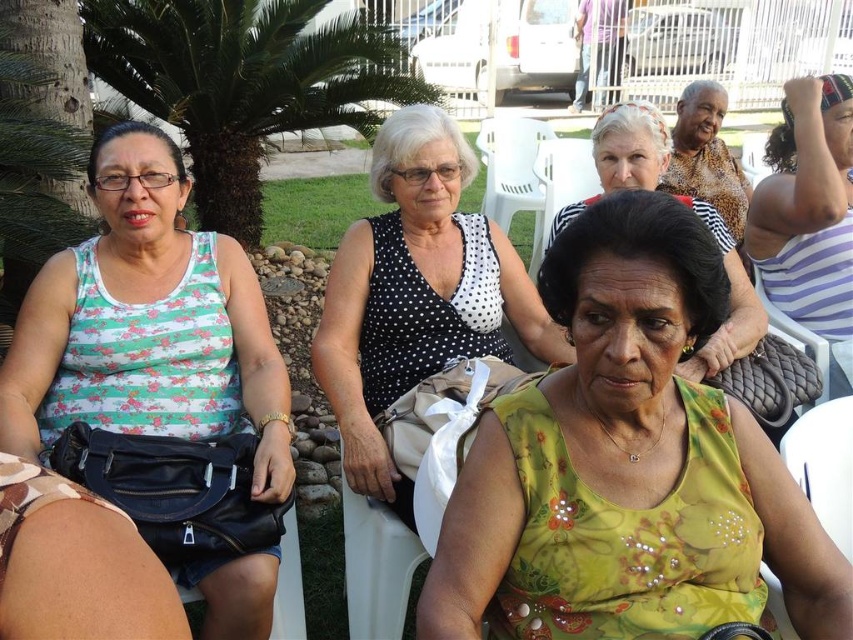
Locate an element on the screen. The image size is (853, 640). green sequined blouse at center is located at coordinates (627, 465).

Who is taller, green sequined blouse at center or green floral dress at center?

Standing taller between the two is green floral dress at center.

Measure the distance between point (517, 440) and camera.

1.45 meters

The width and height of the screenshot is (853, 640). In order to click on green sequined blouse at center in this screenshot , I will do `click(627, 465)`.

Does striped fabric shirt at upper right appear on the right side of green floral dress at center?

Yes, striped fabric shirt at upper right is to the right of green floral dress at center.

Does striped fabric shirt at upper right have a greater width compared to green floral dress at center?

In fact, striped fabric shirt at upper right might be narrower than green floral dress at center.

Which is in front, point (813, 240) or point (636, 116)?

Positioned in front is point (636, 116).

The image size is (853, 640). In order to click on striped fabric shirt at upper right in this screenshot , I will do `click(807, 208)`.

Where is `green sequined blouse at center`? green sequined blouse at center is located at coordinates (627, 465).

Between point (683, 625) and point (809, 333), which one is positioned in front?

Positioned in front is point (683, 625).

The height and width of the screenshot is (640, 853). I want to click on green sequined blouse at center, so click(x=627, y=465).